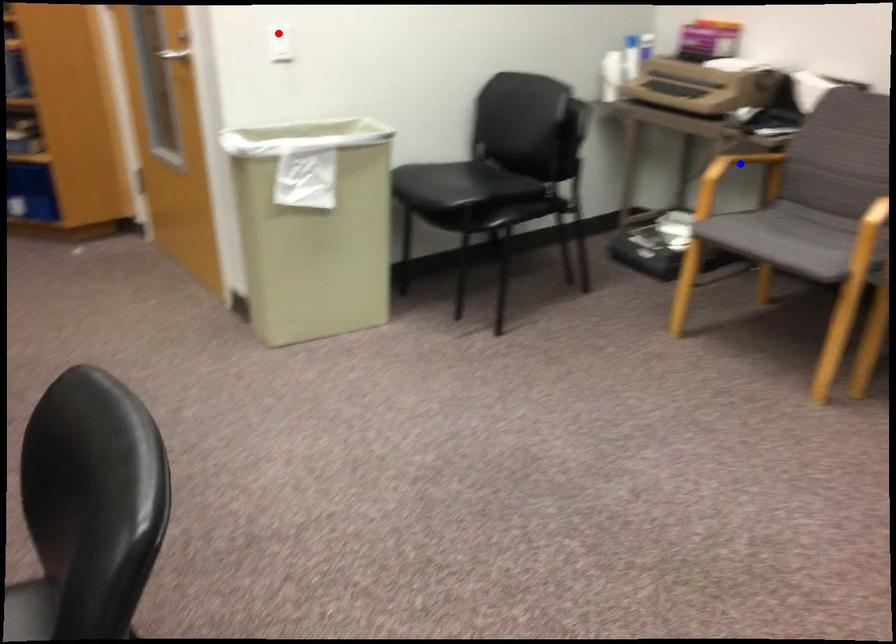
Question: In the image, two points are highlighted. Which point is nearer to the camera? Reply with the corresponding letter.

Choices:
 (A) blue point
 (B) red point

Answer: (B)